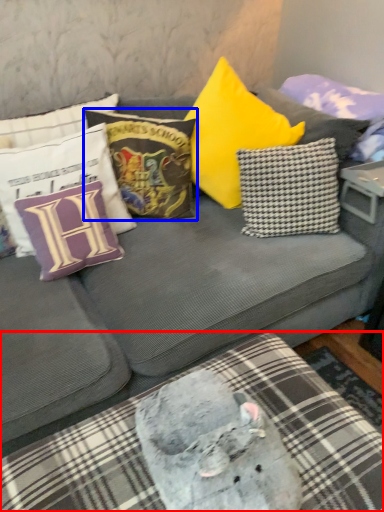
Question: Which of the following is the farthest to the observer, bedding (highlighted by a red box) or pillow (highlighted by a blue box)?

Choices:
 (A) bedding
 (B) pillow

Answer: (B)